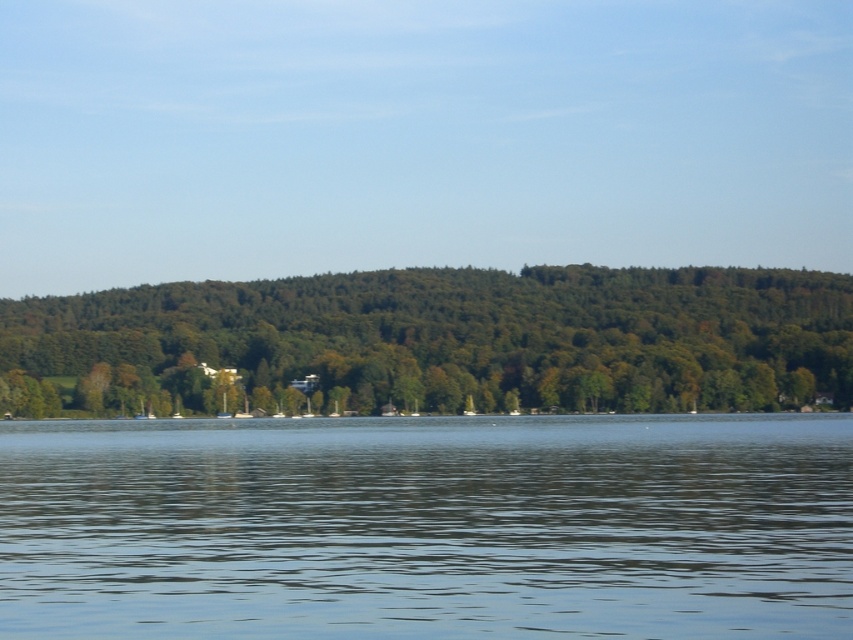
Question: Where is transparent water at center located in relation to green leafy trees at center in the image?

Choices:
 (A) right
 (B) left

Answer: (A)

Question: Does transparent water at center lie behind green leafy trees at center?

Choices:
 (A) yes
 (B) no

Answer: (B)

Question: Which point is closer to the camera?

Choices:
 (A) (265, 432)
 (B) (520, 333)

Answer: (A)

Question: Which object appears closest to the camera in this image?

Choices:
 (A) transparent water at center
 (B) green leafy trees at center

Answer: (A)

Question: Which of the following is the closest to the observer?

Choices:
 (A) (364, 474)
 (B) (524, 378)

Answer: (A)

Question: Is transparent water at center further to camera compared to green leafy trees at center?

Choices:
 (A) no
 (B) yes

Answer: (A)